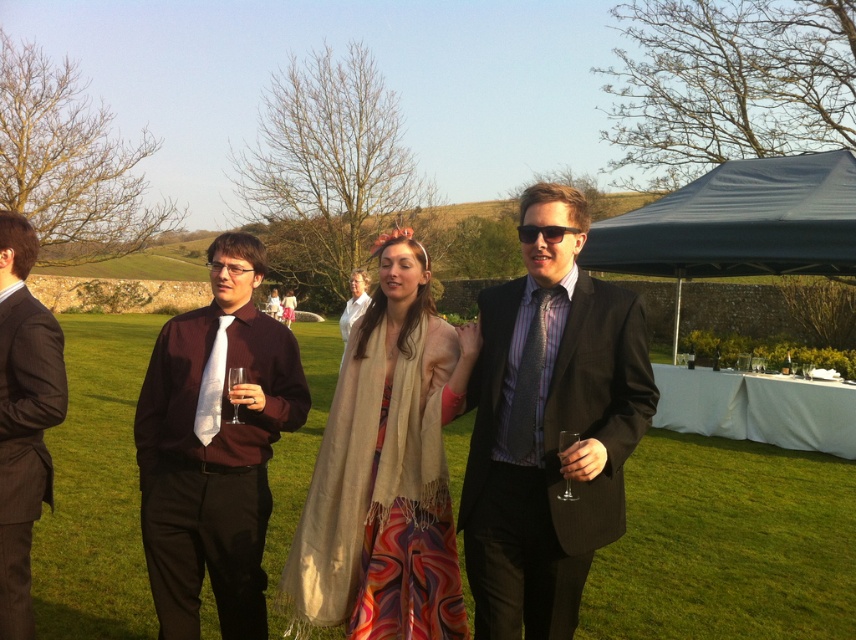
Question: Is beige scarf at center above matte burgundy shirt at center?

Choices:
 (A) yes
 (B) no

Answer: (B)

Question: Which is nearer to the green grass at center?

Choices:
 (A) beige scarf at center
 (B) dark blue tarp at upper right
 (C) matte black suit at center
 (D) white silk tie at center

Answer: (A)

Question: Can you confirm if green grass at center is smaller than beige scarf at center?

Choices:
 (A) yes
 (B) no

Answer: (B)

Question: Which point appears farthest from the camera in this image?

Choices:
 (A) (22, 234)
 (B) (402, 300)
 (C) (789, 173)

Answer: (C)

Question: Which point is farther to the camera?

Choices:
 (A) (162, 608)
 (B) (528, 413)
 (C) (727, 200)
 (D) (3, 490)

Answer: (C)

Question: Does green grass at center appear on the left side of matte burgundy shirt at center?

Choices:
 (A) yes
 (B) no

Answer: (A)